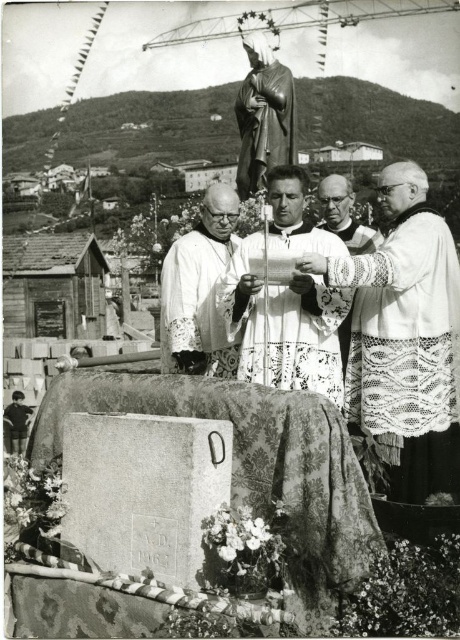
The image size is (460, 640). What do you see at coordinates (264, 124) in the screenshot?
I see `shiny gold statue at center` at bounding box center [264, 124].

Can you confirm if shiny gold statue at center is shorter than white lace robe at right?

Yes.

Is point (251, 145) positioned before point (339, 230)?

No, (251, 145) is further to viewer.

You are a GUI agent. You are given a task and a screenshot of the screen. Output one action in this format:
    pyautogui.click(x=<x>, y=<y>)
    Task: Click on the shiny gold statue at center
    
    Given the screenshot: What is the action you would take?
    pyautogui.click(x=264, y=124)

Is white lace robe at center wider than white lace fabric at center?

No.

Does white lace robe at center appear on the right side of white lace fabric at center?

Correct, you'll find white lace robe at center to the right of white lace fabric at center.

Locate an element on the screen. white lace robe at center is located at coordinates (282, 328).

Image resolution: width=460 pixels, height=640 pixels. Describe the element at coordinates (197, 285) in the screenshot. I see `white lace fabric at center` at that location.

Who is more forward, [208,321] or [366,240]?

Positioned in front is point [208,321].

Between point (229, 348) and point (355, 228), which one is positioned behind?

The point (355, 228) is behind.

Find the location of `white lace fabric at center`. white lace fabric at center is located at coordinates (197, 285).